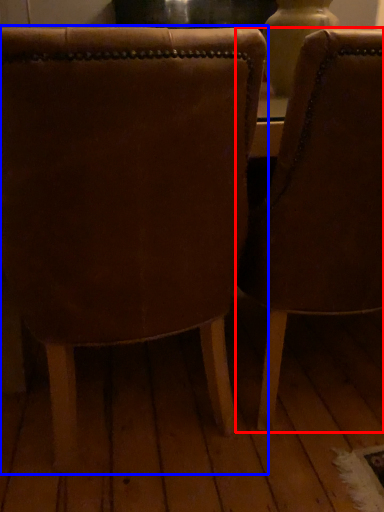
Question: Which point is closer to the camera, chair (highlighted by a red box) or chair (highlighted by a blue box)?

Choices:
 (A) chair
 (B) chair

Answer: (B)